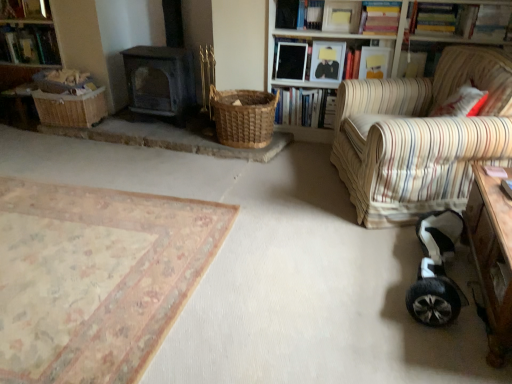
At what (x,y) coordinates should I click in order to perform the action: click on hardcover book at upper left, arranged as the 2th book when viewed from the left. Please return your answer as a coordinate pair (x, y). The image size is (512, 384). Looking at the image, I should click on (29, 44).

Describe the element at coordinates (298, 37) in the screenshot. I see `wooden bookshelf at upper right` at that location.

What do you see at coordinates (25, 9) in the screenshot? The height and width of the screenshot is (384, 512). I see `hardcover book at upper left, arranged as the 10th book when viewed from the right` at bounding box center [25, 9].

The width and height of the screenshot is (512, 384). What do you see at coordinates (243, 117) in the screenshot? I see `woven brown basket at center, placed as the first basket when sorted from right to left` at bounding box center [243, 117].

In order to face white paper book at upper center, the 2th book when ordered from right to left, should I rotate leftwards or rightwards?

Turn right by 15.607 degrees to look at white paper book at upper center, the 2th book when ordered from right to left.

Image resolution: width=512 pixels, height=384 pixels. Describe the element at coordinates (492, 258) in the screenshot. I see `wooden desk at lower right` at that location.

Locate an element on the screen. Image resolution: width=512 pixels, height=384 pixels. wooden frame at upper center, arranged as the 6th book when viewed from the left is located at coordinates (341, 16).

From a real-world perspective, who is located higher, woven brown basket at left, the second basket viewed from the right, or striped fabric armchair at right?

striped fabric armchair at right, from a real-world perspective.

From the image's perspective, is woven brown basket at left, the second basket viewed from the right, located above striped fabric armchair at right?

Yes, from the image's perspective, woven brown basket at left, the second basket viewed from the right, is above striped fabric armchair at right.

Would you consider woven brown basket at left, marked as the first basket in a left-to-right arrangement, to be distant from striped fabric armchair at right?

woven brown basket at left, marked as the first basket in a left-to-right arrangement, is positioned a significant distance from striped fabric armchair at right.

Can you confirm if woven brown basket at left, the second basket viewed from the right, is thinner than striped fabric armchair at right?

Correct, the width of woven brown basket at left, the second basket viewed from the right, is less than that of striped fabric armchair at right.

Is wooden bookshelf at upper right oriented towards matte black frame at upper center, which is the sixth book in right-to-left order?

Yes, wooden bookshelf at upper right is aimed at matte black frame at upper center, which is the sixth book in right-to-left order.

Is wooden bookshelf at upper right positioned in front of matte black frame at upper center, which is the fifth book from left to right?

Yes, wooden bookshelf at upper right is closer to the viewer.

Considering the sizes of objects wooden bookshelf at upper right and matte black frame at upper center, which is the sixth book in right-to-left order, in the image provided, who is shorter, wooden bookshelf at upper right or matte black frame at upper center, which is the sixth book in right-to-left order,?

With less height is matte black frame at upper center, which is the sixth book in right-to-left order.

From the image's perspective, is wooden bookshelf at upper right located beneath matte black frame at upper center, which is the fifth book from left to right?

Correct, wooden bookshelf at upper right appears lower than matte black frame at upper center, which is the fifth book from left to right, in the image.

Which book is the 3rd one when counting from the back of the white paper book at upper center, the 2th book when ordered from right to left? Please provide its 2D coordinates.

[(304, 107)]

Is white paper book at upper center, positioned as the 9th book in left-to-right order, touching hardcover books at upper center, the 4th book positioned from the left?

No, white paper book at upper center, positioned as the 9th book in left-to-right order, is not touching hardcover books at upper center, the 4th book positioned from the left.

Between point (374, 64) and point (302, 101), which one is positioned behind?

The point (302, 101) is farther from the camera.

Is hardcover book at upper right, marked as the 4th book in a right-to-left arrangement, turned away from hardcover book at upper left, the first book in the left-to-right sequence?

hardcover book at upper right, marked as the 4th book in a right-to-left arrangement, is not turned away from hardcover book at upper left, the first book in the left-to-right sequence.

Which point is more distant from viewer, (354, 54) or (13, 14)?

The point (13, 14) is more distant.

Would you say hardcover book at upper right, marked as the 4th book in a right-to-left arrangement, is inside or outside hardcover book at upper left, the first book in the left-to-right sequence?

hardcover book at upper right, marked as the 4th book in a right-to-left arrangement, is outside hardcover book at upper left, the first book in the left-to-right sequence.

You are a GUI agent. You are given a task and a screenshot of the screen. Output one action in this format:
    pyautogui.click(x=<x>, y=<y>)
    Task: Click on the 6th book to the left of the hardcover book at upper right, the 7th book viewed from the left, starting your count from the anchor
    The height and width of the screenshot is (384, 512).
    Given the screenshot: What is the action you would take?
    pyautogui.click(x=25, y=9)

Which is in front, point (500, 219) or point (2, 27)?

Point (500, 219)

Is wooden desk at lower right at the left side of hardcover book at upper left, arranged as the 2th book when viewed from the left?

No, wooden desk at lower right is not to the left of hardcover book at upper left, arranged as the 2th book when viewed from the left.

Is hardcover book at upper left, the ninth book positioned from the right, inside wooden desk at lower right?

That's incorrect, hardcover book at upper left, the ninth book positioned from the right, is not inside wooden desk at lower right.

From the picture: From the image's perspective, does hardcover book at upper right, the 10th book viewed from the left, appear higher than black glossy book at upper center, which is the third book from left to right?

Indeed, from the image's perspective, hardcover book at upper right, the 10th book viewed from the left, is shown above black glossy book at upper center, which is the third book from left to right.

From a real-world perspective, does hardcover book at upper right, the first book in the right-to-left sequence, sit lower than black glossy book at upper center, which is the third book from left to right?

Incorrect, from a real-world perspective, hardcover book at upper right, the first book in the right-to-left sequence, is higher than black glossy book at upper center, which is the third book from left to right.

Is hardcover book at upper right, the 10th book viewed from the left, far from black glossy book at upper center, which is the third book from left to right?

hardcover book at upper right, the 10th book viewed from the left, is far away from black glossy book at upper center, which is the third book from left to right.

Does matte black frame at upper center, which is the fifth book from left to right, have a smaller size compared to hardcover book at upper right, the 10th book viewed from the left?

Indeed, matte black frame at upper center, which is the fifth book from left to right, has a smaller size compared to hardcover book at upper right, the 10th book viewed from the left.

Is matte black frame at upper center, which is the sixth book in right-to-left order, oriented towards hardcover book at upper right, the 10th book viewed from the left?

No, matte black frame at upper center, which is the sixth book in right-to-left order, is not aimed at hardcover book at upper right, the 10th book viewed from the left.

Does point (384, 40) come farther from viewer compared to point (459, 3)?

Yes.

From a real-world perspective, is matte black frame at upper center, which is the sixth book in right-to-left order, below hardcover book at upper right, the 10th book viewed from the left?

Yes, from a real-world perspective, matte black frame at upper center, which is the sixth book in right-to-left order, is under hardcover book at upper right, the 10th book viewed from the left.

This screenshot has height=384, width=512. I want to click on chair below the woven brown basket at left, marked as the first basket in a left-to-right arrangement (from the image's perspective), so click(420, 138).

Identify the location of book that is the 4th one when counting backward from the wooden bookshelf at upper right. (311, 58).

Which object lies further to the anchor point hardcover book at upper right, acting as the 3th book starting from the right, black glossy book at upper center, which is the third book from left to right, or striped fabric armchair at right?

striped fabric armchair at right is further to hardcover book at upper right, acting as the 3th book starting from the right.

From the image, which object appears to be nearer to hardcover book at upper right, the eighth book positioned from the left, black glossy book at upper center, the eighth book in the right-to-left sequence, or white paper book at upper center, positioned as the 9th book in left-to-right order?

Based on the image, white paper book at upper center, positioned as the 9th book in left-to-right order, appears to be nearer to hardcover book at upper right, the eighth book positioned from the left.

Looking at the image, which one is located further to white paper book at upper center, positioned as the 9th book in left-to-right order, black glossy book at upper center, which is the third book from left to right, or matte black frame at upper center, which is the fifth book from left to right?

The object further to white paper book at upper center, positioned as the 9th book in left-to-right order, is black glossy book at upper center, which is the third book from left to right.

When comparing their distances from hardcover book at upper right, marked as the 4th book in a right-to-left arrangement, does striped fabric armchair at right or wooden desk at lower right seem further?

Based on the image, wooden desk at lower right appears to be further to hardcover book at upper right, marked as the 4th book in a right-to-left arrangement.

Looking at the image, which one is located closer to matte black frame at upper center, which is the sixth book in right-to-left order, woven brown basket at center, the 2th basket positioned from the left, or hardcover book at upper right, the eighth book positioned from the left?

Among the two, hardcover book at upper right, the eighth book positioned from the left, is located nearer to matte black frame at upper center, which is the sixth book in right-to-left order.

Based on their spatial positions, is matte black frame at upper center, which is the fifth book from left to right, or hardcover book at upper right, the 7th book viewed from the left, closer to beige floral rug at lower left?

Among the two, matte black frame at upper center, which is the fifth book from left to right, is located nearer to beige floral rug at lower left.

Considering their positions, is striped fabric armchair at right positioned closer to white paper book at upper center, positioned as the 9th book in left-to-right order, than black glossy book at upper center, the eighth book in the right-to-left sequence?

black glossy book at upper center, the eighth book in the right-to-left sequence, lies closer to white paper book at upper center, positioned as the 9th book in left-to-right order, than the other object.

When comparing their distances from hardcover books at upper center, acting as the seventh book starting from the right, does wooden desk at lower right or wooden frame at upper center, arranged as the 6th book when viewed from the left, seem closer?

wooden frame at upper center, arranged as the 6th book when viewed from the left, is closer to hardcover books at upper center, acting as the seventh book starting from the right.

You are a GUI agent. You are given a task and a screenshot of the screen. Output one action in this format:
    pyautogui.click(x=<x>, y=<y>)
    Task: Click on the chair between hardcover book at upper left, the first book in the left-to-right sequence, and hardcover book at upper right, the first book in the right-to-left sequence, from left to right
    The image size is (512, 384).
    Given the screenshot: What is the action you would take?
    pyautogui.click(x=420, y=138)

Where is `basket located between wooden desk at lower right and white paper book at upper center, the 2th book when ordered from right to left, in the depth direction`? basket located between wooden desk at lower right and white paper book at upper center, the 2th book when ordered from right to left, in the depth direction is located at coordinates (243, 117).

The image size is (512, 384). Identify the location of plain between hardcover book at upper left, the ninth book positioned from the right, and hardcover book at upper right, the 10th book viewed from the left. (95, 277).

This screenshot has height=384, width=512. What are the coordinates of `basket between striped fabric armchair at right and wooden frame at upper center, placed as the 5th book when sorted from right to left, along the z-axis` in the screenshot? It's located at (243, 117).